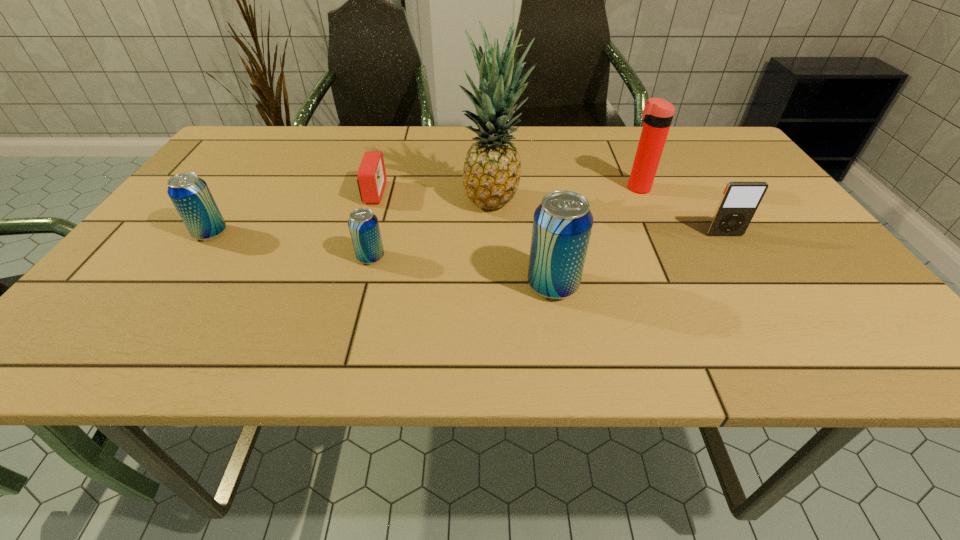
In order to click on free space between the iPod and the tallest object in this screenshot , I will do `click(609, 219)`.

Identify the location of free space that is in between the tallest beer can and the sixth tallest object. The width and height of the screenshot is (960, 540). (462, 271).

Identify the location of free area in between the shortest object and the pineapple. The height and width of the screenshot is (540, 960). (434, 198).

You are a GUI agent. You are given a task and a screenshot of the screen. Output one action in this format:
    pyautogui.click(x=<x>, y=<y>)
    Task: Click on the free spot between the second beer can from left to right and the second object from right to left
    Image resolution: width=960 pixels, height=540 pixels.
    Given the screenshot: What is the action you would take?
    pyautogui.click(x=504, y=222)

Identify which object is located as the fifth nearest to the second object from right to left. Please provide its 2D coordinates. Your answer should be formatted as a tuple, i.e. [(x, y)], where the tuple contains the x and y coordinates of a point satisfying the conditions above.

[(371, 177)]

Point out which object is positioned as the fourth nearest to the rightmost object. Please provide its 2D coordinates. Your answer should be formatted as a tuple, i.e. [(x, y)], where the tuple contains the x and y coordinates of a point satisfying the conditions above.

[(363, 224)]

At what (x,y) coordinates should I click in order to perform the action: click on beer can that stands as the second closest to the pineapple. Please return your answer as a coordinate pair (x, y). This screenshot has width=960, height=540. Looking at the image, I should click on (363, 224).

Locate an element on the screen. beer can that stands as the third closest to the shortest object is located at coordinates (562, 224).

Where is `vacant position in the image that satisfies the following two spatial constraints: 1. on the back side of the tallest beer can; 2. on the right side of the thermos bottle`? vacant position in the image that satisfies the following two spatial constraints: 1. on the back side of the tallest beer can; 2. on the right side of the thermos bottle is located at coordinates (537, 188).

The image size is (960, 540). I want to click on free location that satisfies the following two spatial constraints: 1. on the front-facing side of the shortest object; 2. on the left side of the pineapple, so click(371, 202).